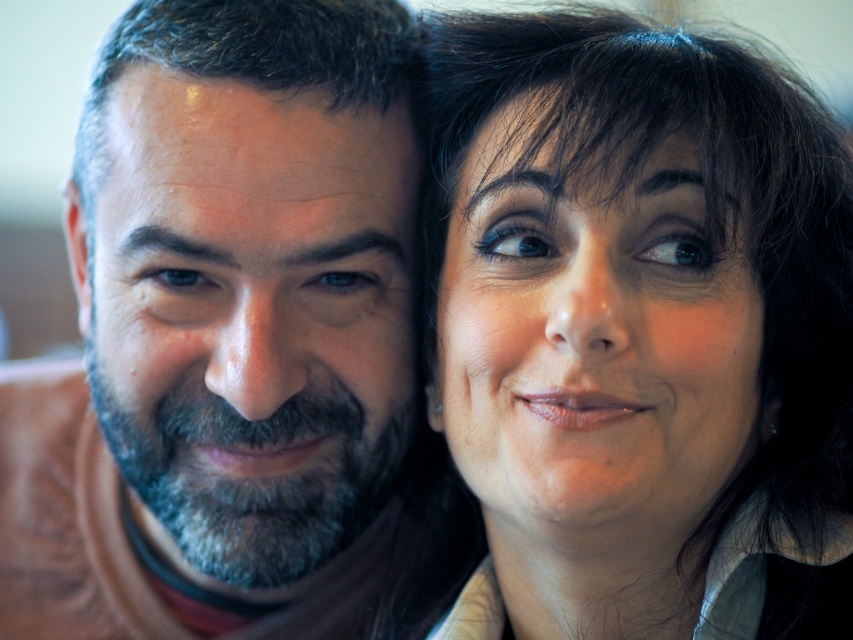
You are a photographer setting up for a portrait session. You need to ensure that both the smooth black hair at upper right and the brown matte shirt at left are clearly visible in the frame. Based on their positions, which object should be placed closer to the edge of the frame to avoid cropping?

The smooth black hair at upper right should be placed closer to the edge of the frame since it is positioned on the right side of the brown matte shirt at left, making it more likely to be at the frame edge if not adjusted.